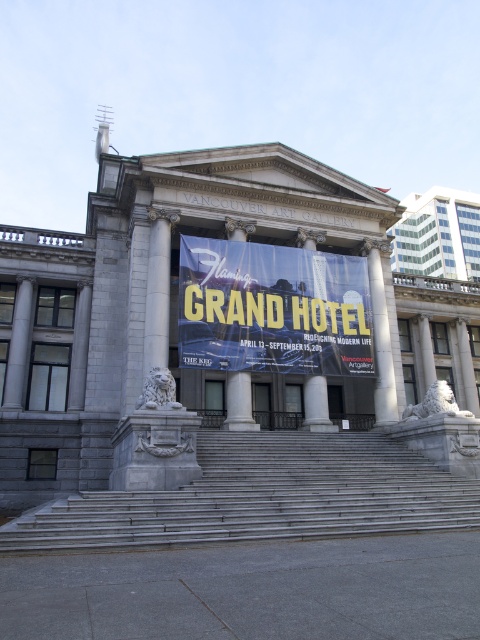
Question: Does blue fabric banner at center have a larger size compared to gray stone column at center?

Choices:
 (A) no
 (B) yes

Answer: (B)

Question: Which of the following is the farthest from the observer?

Choices:
 (A) (432, 346)
 (B) (324, 440)
 (C) (384, 413)
 (D) (309, 353)

Answer: (A)

Question: Does blue fabric banner at center have a larger size compared to gray stone column at center?

Choices:
 (A) no
 (B) yes

Answer: (B)

Question: Which object appears closest to the camera in this image?

Choices:
 (A) gray stone stairs at center
 (B) blue fabric banner at center

Answer: (A)

Question: Does gray stone stairs at center lie behind blue fabric banner at center?

Choices:
 (A) no
 (B) yes

Answer: (A)

Question: Based on their relative distances, which object is nearer to the gray stone stairs at center?

Choices:
 (A) blue fabric banner at center
 (B) gray stone column at center

Answer: (A)